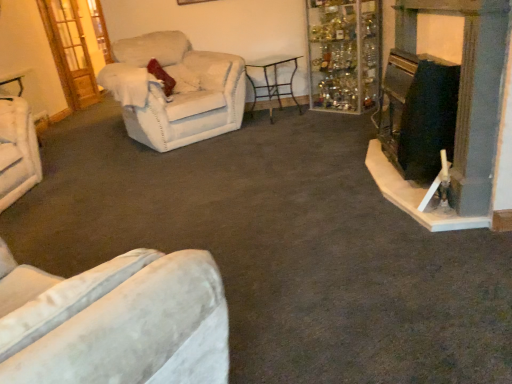
Question: Can you confirm if metallic black table at center is smaller than wooden door at upper left?

Choices:
 (A) yes
 (B) no

Answer: (B)

Question: Is metallic black table at center turned away from wooden door at upper left?

Choices:
 (A) no
 (B) yes

Answer: (A)

Question: Considering the relative sizes of metallic black table at center and wooden door at upper left in the image provided, is metallic black table at center bigger than wooden door at upper left?

Choices:
 (A) no
 (B) yes

Answer: (B)

Question: Does metallic black table at center come in front of wooden door at upper left?

Choices:
 (A) no
 (B) yes

Answer: (B)

Question: From the image's perspective, would you say metallic black table at center is positioned over wooden door at upper left?

Choices:
 (A) no
 (B) yes

Answer: (A)

Question: In terms of size, does velvet beige armchair at left, which is the first chair in left-to-right order, appear bigger or smaller than clear glass cabinet at upper right?

Choices:
 (A) big
 (B) small

Answer: (B)

Question: Looking at their shapes, would you say velvet beige armchair at left, which is the first chair in left-to-right order, is wider or thinner than clear glass cabinet at upper right?

Choices:
 (A) wide
 (B) thin

Answer: (B)

Question: From the image's perspective, is velvet beige armchair at left, which is the first chair in left-to-right order, above or below clear glass cabinet at upper right?

Choices:
 (A) below
 (B) above

Answer: (A)

Question: Is velvet beige armchair at left, the second chair viewed from the right, in front of or behind clear glass cabinet at upper right in the image?

Choices:
 (A) behind
 (B) front

Answer: (B)

Question: Relative to black matte fireplace at right, is velvet beige armchair at left, the second chair viewed from the right, in front or behind?

Choices:
 (A) front
 (B) behind

Answer: (B)

Question: Is velvet beige armchair at left, the second chair viewed from the right, wider or thinner than black matte fireplace at right?

Choices:
 (A) wide
 (B) thin

Answer: (A)

Question: From a real-world perspective, relative to black matte fireplace at right, is velvet beige armchair at left, the second chair viewed from the right, vertically above or below?

Choices:
 (A) below
 (B) above

Answer: (A)

Question: Considering the positions of point (15, 139) and point (484, 18), is point (15, 139) closer or farther from the camera than point (484, 18)?

Choices:
 (A) closer
 (B) farther

Answer: (B)

Question: Is beige fabric armchair at left, the 2th chair when ordered from left to right, to the left or to the right of metallic black table at center in the image?

Choices:
 (A) left
 (B) right

Answer: (A)

Question: Looking at their shapes, would you say beige fabric armchair at left, the first chair viewed from the right, is wider or thinner than metallic black table at center?

Choices:
 (A) wide
 (B) thin

Answer: (A)